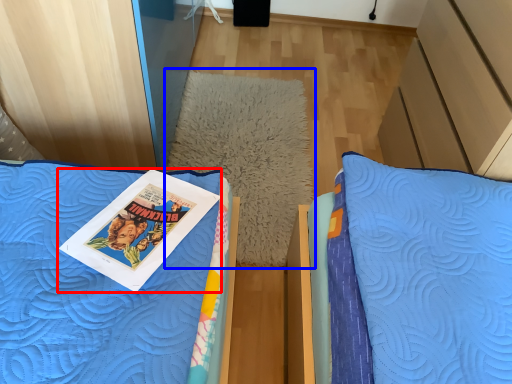
Question: Which point is closer to the camera, book (highlighted by a red box) or pillow (highlighted by a blue box)?

Choices:
 (A) book
 (B) pillow

Answer: (A)